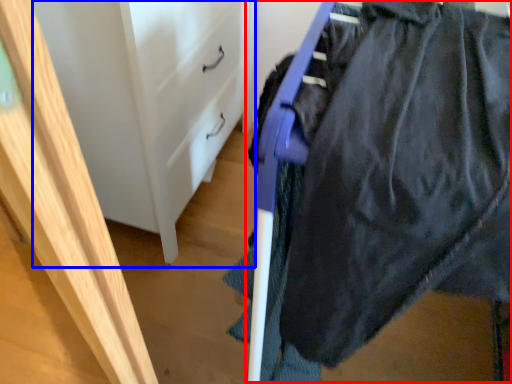
Question: Which object appears closest to the camera in this image, wide (highlighted by a red box) or file cabinet (highlighted by a blue box)?

Choices:
 (A) wide
 (B) file cabinet

Answer: (A)